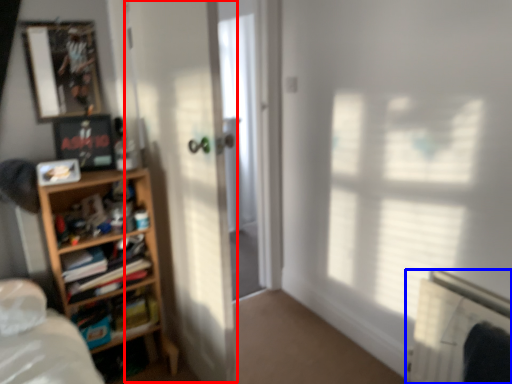
Question: Which of the following is the farthest to the observer, screen door (highlighted by a red box) or radiator (highlighted by a blue box)?

Choices:
 (A) screen door
 (B) radiator

Answer: (B)